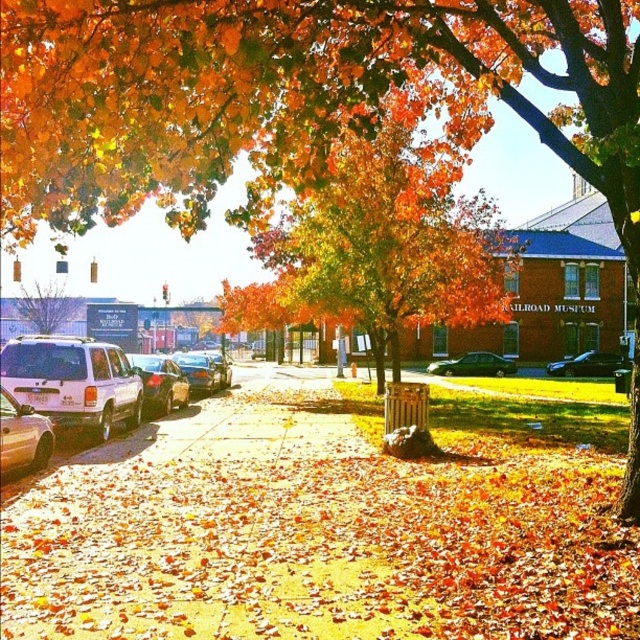
Who is higher up, white matte suv at left or brown textured tree at left?

brown textured tree at left is higher up.

Does white matte suv at left have a smaller size compared to brown textured tree at left?

Correct, white matte suv at left occupies less space than brown textured tree at left.

Describe the element at coordinates (72, 381) in the screenshot. I see `white matte suv at left` at that location.

Where is `white matte suv at left`? The image size is (640, 640). white matte suv at left is located at coordinates (72, 381).

Between yellow gravel at center and green matte car at center, which one has less height?

yellow gravel at center is shorter.

Which is in front, point (570, 444) or point (504, 369)?

Point (570, 444) is more forward.

You are a GUI agent. You are given a task and a screenshot of the screen. Output one action in this format:
    pyautogui.click(x=<x>, y=<y>)
    Task: Click on the yellow gravel at center
    
    Given the screenshot: What is the action you would take?
    pyautogui.click(x=326, y=524)

The width and height of the screenshot is (640, 640). What do you see at coordinates (45, 307) in the screenshot?
I see `brown textured tree at left` at bounding box center [45, 307].

Image resolution: width=640 pixels, height=640 pixels. What are the coordinates of `brown textured tree at left` in the screenshot? It's located at (45, 307).

What do you see at coordinates (45, 307) in the screenshot?
I see `brown textured tree at left` at bounding box center [45, 307].

This screenshot has height=640, width=640. Identify the location of brown textured tree at left. (45, 307).